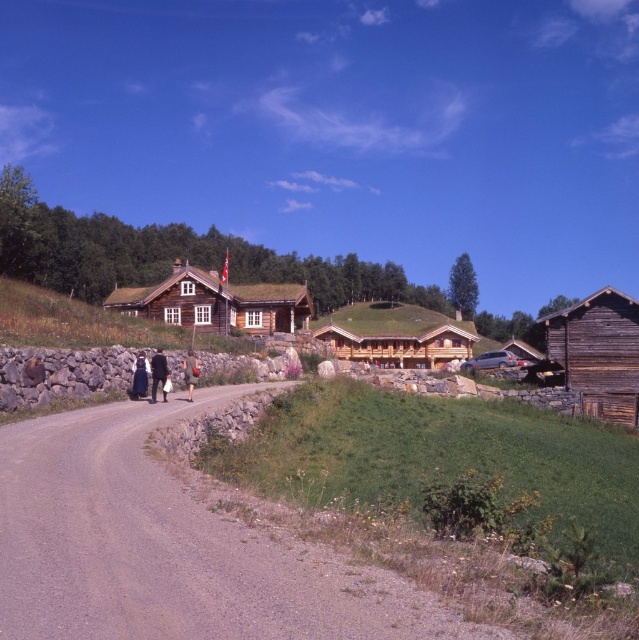
Is wooden barn at right above dark brown leather boots at center?

Yes.

Who is more forward, (x=590, y=344) or (x=187, y=396)?

Point (x=187, y=396)

Does point (576, 353) lie in front of point (189, 355)?

No, (576, 353) is behind (189, 355).

Identify the location of wooden barn at right. (597, 353).

Is brown gravel road at center closer to camera compared to dark brown leather boots at center?

Yes, it is in front of dark brown leather boots at center.

Is brown gravel road at center to the right of dark brown leather boots at center from the viewer's perspective?

Yes, brown gravel road at center is to the right of dark brown leather boots at center.

Locate an element on the screen. brown gravel road at center is located at coordinates (171, 547).

Does point (387, 342) lie in front of point (157, 378)?

That is False.

Does brown wooden hut at center appear over dark blue fabric coat at center?

Actually, brown wooden hut at center is below dark blue fabric coat at center.

Between point (435, 340) and point (162, 396), which one is positioned in front?

Point (162, 396) is more forward.

I want to click on brown wooden hut at center, so click(397, 342).